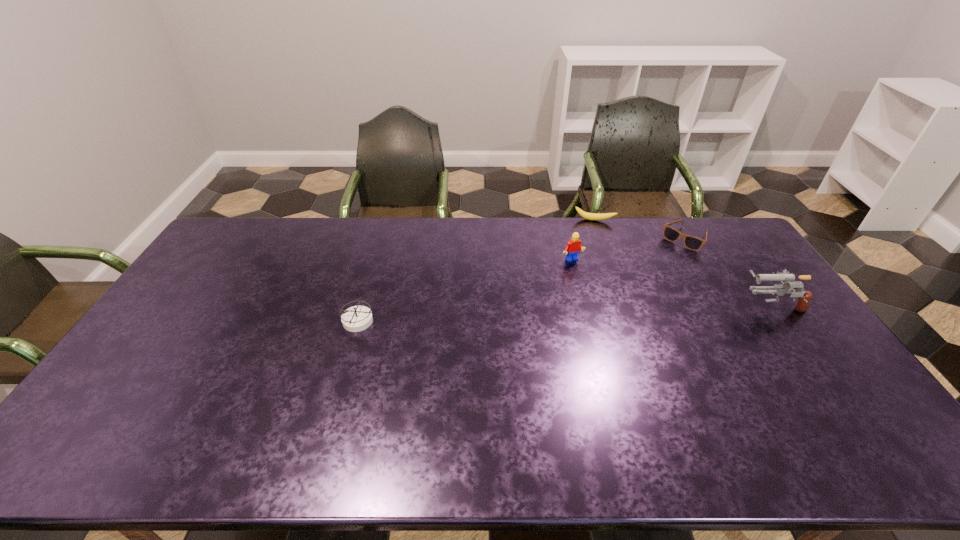
At what (x,y) coordinates should I click in order to perform the action: click on empty space between the sunglasses and the gun. Please return your answer as a coordinate pair (x, y). Looking at the image, I should click on (728, 272).

The width and height of the screenshot is (960, 540). Identify the location of free space that is in between the gun and the fourth nearest object. (728, 272).

Locate an element on the screen. The height and width of the screenshot is (540, 960). free space that is in between the tallest object and the second farthest object is located at coordinates (728, 272).

Find the location of a particular element. blank region between the compass and the tallest object is located at coordinates (564, 313).

Find the location of a particular element. empty location between the third farthest object and the gun is located at coordinates (671, 283).

Locate an element on the screen. The width and height of the screenshot is (960, 540). free space between the third object from left to right and the gun is located at coordinates (683, 263).

Image resolution: width=960 pixels, height=540 pixels. I want to click on vacant space that's between the sunglasses and the tallest object, so click(x=728, y=272).

You are a GUI agent. You are given a task and a screenshot of the screen. Output one action in this format:
    pyautogui.click(x=<x>, y=<y>)
    Task: Click on the free spot between the compass and the third nearest object
    The width and height of the screenshot is (960, 540).
    Given the screenshot: What is the action you would take?
    pyautogui.click(x=465, y=290)

Identify the location of empty space between the fourth object from right to left and the gun. (671, 283).

Point out which object is positioned as the third nearest to the compass. Please provide its 2D coordinates. Your answer should be formatted as a tuple, i.e. [(x, y)], where the tuple contains the x and y coordinates of a point satisfying the conditions above.

[(693, 243)]